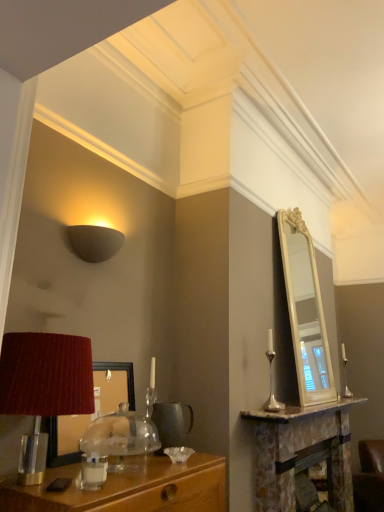
Question: Looking at the image, does matte red lampshade at left seem bigger or smaller compared to brown leather swivel chair at lower right?

Choices:
 (A) small
 (B) big

Answer: (A)

Question: In terms of height, does matte red lampshade at left look taller or shorter compared to brown leather swivel chair at lower right?

Choices:
 (A) tall
 (B) short

Answer: (B)

Question: Which object is positioned closest to the brown leather swivel chair at lower right?

Choices:
 (A) matte black mirror at left
 (B) matte red lampshade at left
 (C) marble fireplace at right
 (D) matte gray wall sconce at upper left

Answer: (C)

Question: Which is nearer to the brown leather swivel chair at lower right?

Choices:
 (A) matte red lampshade at left
 (B) marble fireplace at right
 (C) matte black mirror at left
 (D) matte gray wall sconce at upper left

Answer: (B)